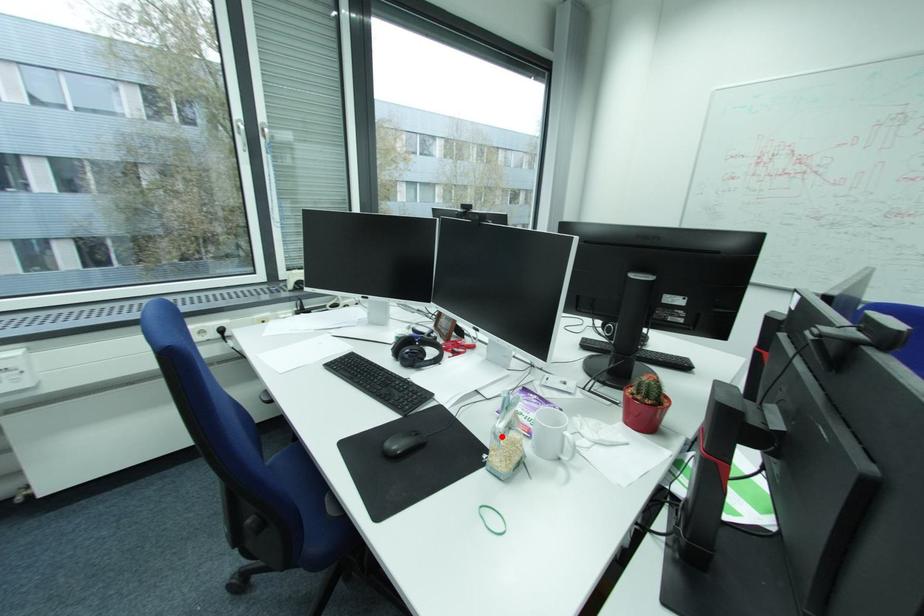
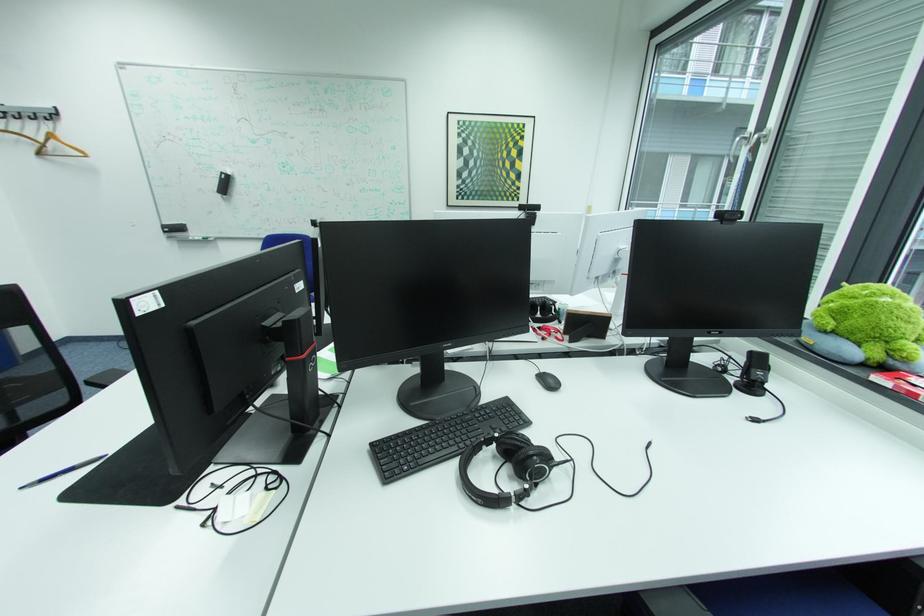
Question: I am providing you with two images of the same scene from different viewpoints. A red point is marked on the first image. At the location where the point appears in image 1, is it still visible in image 2?

Choices:
 (A) Yes
 (B) No

Answer: (B)